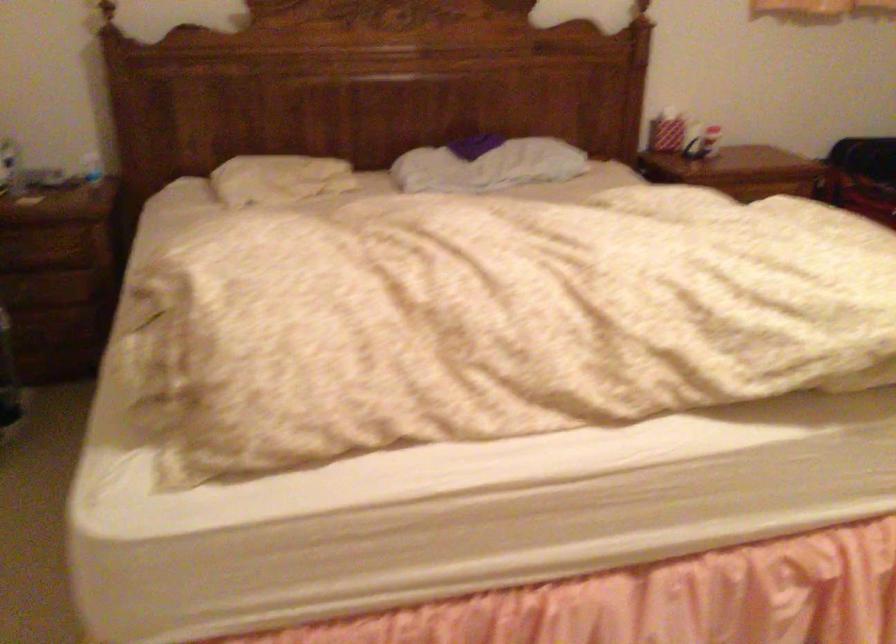
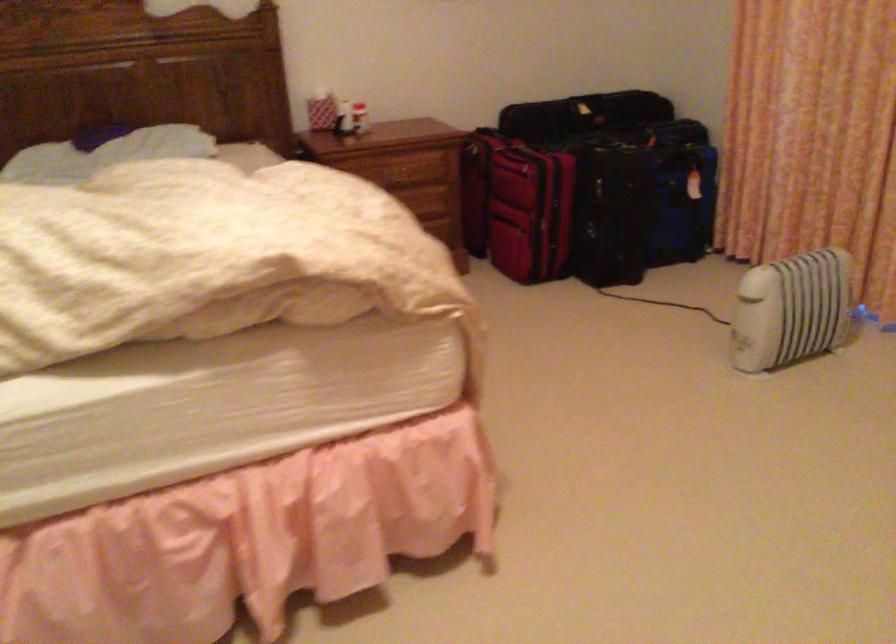
Question: The images are taken continuously from a first-person perspective. In which direction is your viewpoint rotating?

Choices:
 (A) Left
 (B) Right
 (C) Up
 (D) Down

Answer: (B)